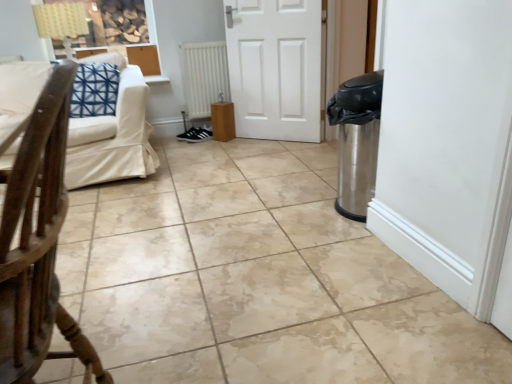
Question: Is black suede sneakers at center taller or shorter than wooden chair at left?

Choices:
 (A) short
 (B) tall

Answer: (A)

Question: Considering the positions of point (193, 135) and point (48, 198), is point (193, 135) closer or farther from the camera than point (48, 198)?

Choices:
 (A) farther
 (B) closer

Answer: (A)

Question: Considering the real-world distances, which object is closest to the beige fabric couch at upper left?

Choices:
 (A) black suede sneakers at center
 (B) white matte radiator at center
 (C) wooden chair at left

Answer: (B)

Question: Estimate the real-world distances between objects in this image. Which object is closer to the black suede sneakers at center?

Choices:
 (A) white matte radiator at center
 (B) beige fabric couch at upper left
 (C) wooden chair at left

Answer: (A)